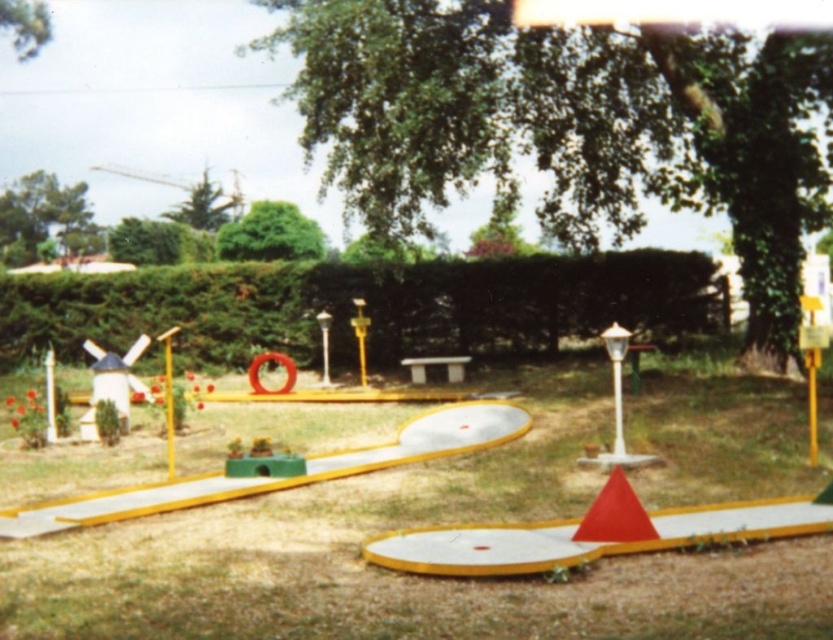
Question: Which object is positioned farthest from the green grass at center?

Choices:
 (A) metallic pole at center
 (B) red matte cone at center

Answer: (A)

Question: Based on their relative distances, which object is farther from the metallic pole at center?

Choices:
 (A) red matte cone at center
 (B) yellow plastic pole at center

Answer: (B)

Question: Does red matte cone at center have a smaller size compared to metallic pole at center?

Choices:
 (A) no
 (B) yes

Answer: (B)

Question: Estimate the real-world distances between objects in this image. Which object is farther from the green grass at center?

Choices:
 (A) green leafy hedge at center
 (B) metallic pole at center
 (C) red matte cone at center
 (D) yellow plastic pole at center

Answer: (A)

Question: Can you confirm if green leafy hedge at center is positioned to the right of red matte cone at center?

Choices:
 (A) no
 (B) yes

Answer: (A)

Question: Can you confirm if green grass at center is positioned to the right of yellow plastic pole at center?

Choices:
 (A) yes
 (B) no

Answer: (A)